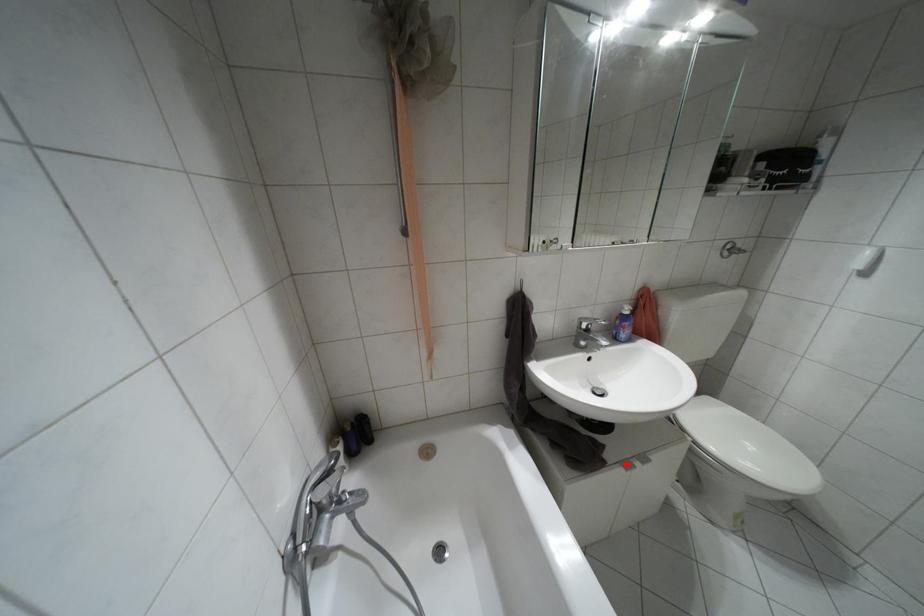
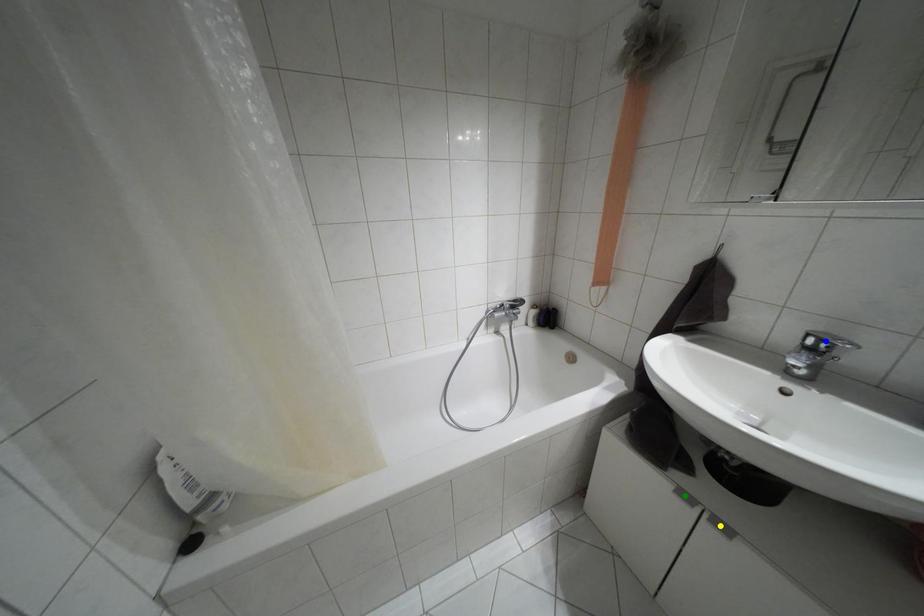
Question: I am providing you with two images of the same scene from different viewpoints. A red point is marked on the first image. You are given multiple points on the second image. Can you choose the point in image 2 that corresponds to the point in image 1?

Choices:
 (A) blue point
 (B) green point
 (C) yellow point

Answer: (B)